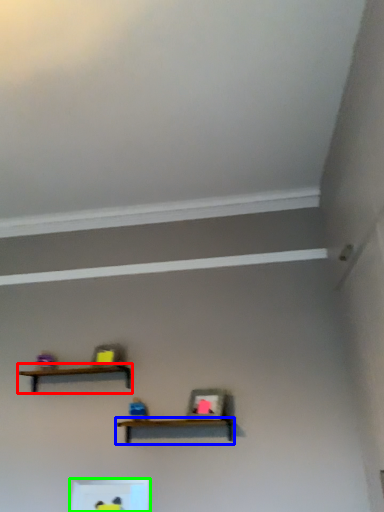
Question: Considering the real-world distances, which object is farthest from shelf (highlighted by a red box)? shelf (highlighted by a blue box) or shelf (highlighted by a green box)?

Choices:
 (A) shelf
 (B) shelf

Answer: (B)